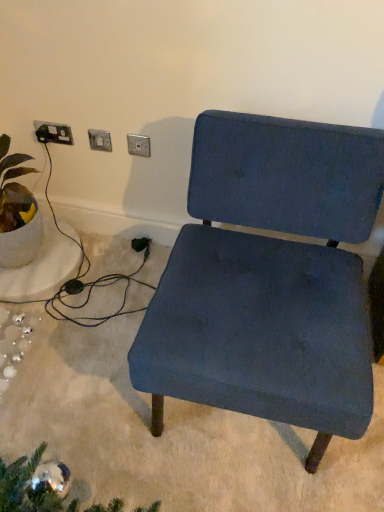
I want to click on matte silver switch at upper center, arranged as the second electric outlet when viewed from the right, so click(x=100, y=140).

The image size is (384, 512). Describe the element at coordinates (100, 140) in the screenshot. I see `matte silver switch at upper center, arranged as the second electric outlet when viewed from the right` at that location.

Where is `matte blue fabric chair at center`? The width and height of the screenshot is (384, 512). matte blue fabric chair at center is located at coordinates (269, 279).

This screenshot has width=384, height=512. Describe the element at coordinates (53, 133) in the screenshot. I see `black plastic socket at upper left, the first electric outlet positioned from the left` at that location.

How much space does black plastic socket at upper left, the first electric outlet positioned from the left, occupy vertically?

→ black plastic socket at upper left, the first electric outlet positioned from the left, is 3.38 inches in height.

The width and height of the screenshot is (384, 512). In order to click on metallic silver outlet at upper center, the 1th electric outlet from the right in this screenshot , I will do `click(138, 145)`.

Starting from the black plastic socket at upper left, the first electric outlet positioned from the left, which electric outlet is the 1st one to the right? Please provide its 2D coordinates.

[(100, 140)]

In the scene shown: Is matte silver switch at upper center, arranged as the second electric outlet when viewed from the right, thinner than black plastic socket at upper left, the first electric outlet positioned from the left?

Incorrect, the width of matte silver switch at upper center, arranged as the second electric outlet when viewed from the right, is not less than that of black plastic socket at upper left, the first electric outlet positioned from the left.

Is matte silver switch at upper center, arranged as the second electric outlet when viewed from the right, bigger than black plastic socket at upper left, placed as the 3th electric outlet when sorted from right to left?

No, matte silver switch at upper center, arranged as the second electric outlet when viewed from the right, is not bigger than black plastic socket at upper left, placed as the 3th electric outlet when sorted from right to left.

In the scene shown: Does matte blue fabric chair at center appear on the left side of black plastic socket at upper left, placed as the 3th electric outlet when sorted from right to left?

No, matte blue fabric chair at center is not to the left of black plastic socket at upper left, placed as the 3th electric outlet when sorted from right to left.

From a real-world perspective, between matte blue fabric chair at center and black plastic socket at upper left, placed as the 3th electric outlet when sorted from right to left, who is vertically higher?

In real-world perspective, black plastic socket at upper left, placed as the 3th electric outlet when sorted from right to left, is above.

From the image's perspective, is matte blue fabric chair at center located above black plastic socket at upper left, placed as the 3th electric outlet when sorted from right to left?

No.

Is matte blue fabric chair at center oriented away from black plastic socket at upper left, placed as the 3th electric outlet when sorted from right to left?

matte blue fabric chair at center is not turned away from black plastic socket at upper left, placed as the 3th electric outlet when sorted from right to left.

Is matte blue fabric chair at center bigger than matte silver switch at upper center, which appears as the 2th electric outlet when viewed from the left?

Yes, matte blue fabric chair at center is bigger than matte silver switch at upper center, which appears as the 2th electric outlet when viewed from the left.

Which is behind, point (336, 307) or point (104, 148)?

The point (104, 148) is more distant.

Based on the photo, would you consider matte blue fabric chair at center to be distant from matte silver switch at upper center, which appears as the 2th electric outlet when viewed from the left?

Actually, matte blue fabric chair at center and matte silver switch at upper center, which appears as the 2th electric outlet when viewed from the left, are a little close together.

In the scene shown: How different are the orientations of matte blue fabric chair at center and matte silver switch at upper center, which appears as the 2th electric outlet when viewed from the left, in degrees?

4.52 degrees.

From the image's perspective, relative to matte silver switch at upper center, which appears as the 2th electric outlet when viewed from the left, is metallic silver outlet at upper center, the 1th electric outlet from the right, above or below?

metallic silver outlet at upper center, the 1th electric outlet from the right, is situated lower than matte silver switch at upper center, which appears as the 2th electric outlet when viewed from the left, in the image.

In the scene shown: Is there a large distance between metallic silver outlet at upper center, the 1th electric outlet from the right, and matte silver switch at upper center, arranged as the second electric outlet when viewed from the right?

No, metallic silver outlet at upper center, the 1th electric outlet from the right, is not far away from matte silver switch at upper center, arranged as the second electric outlet when viewed from the right.

Consider the image. Between metallic silver outlet at upper center, the 1th electric outlet from the right, and matte silver switch at upper center, which appears as the 2th electric outlet when viewed from the left, which one appears on the left side from the viewer's perspective?

matte silver switch at upper center, which appears as the 2th electric outlet when viewed from the left.

How distant is metallic silver outlet at upper center, which is the third electric outlet in left-to-right order, from matte silver switch at upper center, arranged as the second electric outlet when viewed from the right?

11.06 centimeters.

In the scene shown: Measure the distance between metallic silver outlet at upper center, which is the third electric outlet in left-to-right order, and matte blue fabric chair at center.

27.67 inches.

From a real-world perspective, who is located lower, metallic silver outlet at upper center, the 1th electric outlet from the right, or matte blue fabric chair at center?

In real-world perspective, matte blue fabric chair at center is lower.

Is metallic silver outlet at upper center, which is the third electric outlet in left-to-right order, with matte blue fabric chair at center?

metallic silver outlet at upper center, which is the third electric outlet in left-to-right order, and matte blue fabric chair at center are not in contact.

Does metallic silver outlet at upper center, which is the third electric outlet in left-to-right order, appear on the left side of matte blue fabric chair at center?

Indeed, metallic silver outlet at upper center, which is the third electric outlet in left-to-right order, is positioned on the left side of matte blue fabric chair at center.

Considering the positions of points (148, 153) and (3, 156), is point (148, 153) closer to camera compared to point (3, 156)?

No, it is behind (3, 156).

Based on the photo, is metallic silver outlet at upper center, the 1th electric outlet from the right, positioned with its back to green leafy plant in white pot at left?

metallic silver outlet at upper center, the 1th electric outlet from the right, does not have its back to green leafy plant in white pot at left.

This screenshot has width=384, height=512. Find the location of `houseplant below the metallic silver outlet at upper center, the 1th electric outlet from the right (from the image's perspective)`. houseplant below the metallic silver outlet at upper center, the 1th electric outlet from the right (from the image's perspective) is located at coordinates (16, 211).

Would you say matte silver switch at upper center, arranged as the second electric outlet when viewed from the right, is to the left or to the right of metallic silver outlet at upper center, the 1th electric outlet from the right, in the picture?

Clearly, matte silver switch at upper center, arranged as the second electric outlet when viewed from the right, is on the left of metallic silver outlet at upper center, the 1th electric outlet from the right, in the image.

Relative to metallic silver outlet at upper center, which is the third electric outlet in left-to-right order, is matte silver switch at upper center, arranged as the second electric outlet when viewed from the right, in front or behind?

matte silver switch at upper center, arranged as the second electric outlet when viewed from the right, is behind metallic silver outlet at upper center, which is the third electric outlet in left-to-right order.

Is matte silver switch at upper center, arranged as the second electric outlet when viewed from the right, facing towards metallic silver outlet at upper center, the 1th electric outlet from the right?

No, matte silver switch at upper center, arranged as the second electric outlet when viewed from the right, is not turned towards metallic silver outlet at upper center, the 1th electric outlet from the right.

In the image, there is a metallic silver outlet at upper center, which is the third electric outlet in left-to-right order. Where is `electric outlet below it (from a real-world perspective)`? The width and height of the screenshot is (384, 512). electric outlet below it (from a real-world perspective) is located at coordinates (100, 140).

In order to click on electric outlet on the left of matte silver switch at upper center, arranged as the second electric outlet when viewed from the right in this screenshot , I will do `click(53, 133)`.

Locate an element on the screen. the 3rd electric outlet above the matte blue fabric chair at center (from the image's perspective) is located at coordinates (53, 133).

From the image, which object appears to be farther from black plastic socket at upper left, placed as the 3th electric outlet when sorted from right to left, matte blue fabric chair at center or matte silver switch at upper center, arranged as the second electric outlet when viewed from the right?

Among the two, matte blue fabric chair at center is located further to black plastic socket at upper left, placed as the 3th electric outlet when sorted from right to left.

Estimate the real-world distances between objects in this image. Which object is further from green leafy plant in white pot at left, matte silver switch at upper center, arranged as the second electric outlet when viewed from the right, or metallic silver outlet at upper center, which is the third electric outlet in left-to-right order?

metallic silver outlet at upper center, which is the third electric outlet in left-to-right order, is further to green leafy plant in white pot at left.

Considering their positions, is green leafy plant in white pot at left positioned further to matte blue fabric chair at center than matte silver switch at upper center, which appears as the 2th electric outlet when viewed from the left?

green leafy plant in white pot at left.

Looking at the image, which one is located further to green leafy plant in white pot at left, metallic silver outlet at upper center, which is the third electric outlet in left-to-right order, or black plastic socket at upper left, the first electric outlet positioned from the left?

The object further to green leafy plant in white pot at left is metallic silver outlet at upper center, which is the third electric outlet in left-to-right order.

When comparing their distances from metallic silver outlet at upper center, which is the third electric outlet in left-to-right order, does green leafy plant in white pot at left or matte blue fabric chair at center seem closer?

Among the two, green leafy plant in white pot at left is located nearer to metallic silver outlet at upper center, which is the third electric outlet in left-to-right order.

From the image, which object appears to be farther from matte blue fabric chair at center, black plastic socket at upper left, the first electric outlet positioned from the left, or metallic silver outlet at upper center, which is the third electric outlet in left-to-right order?

black plastic socket at upper left, the first electric outlet positioned from the left.

Looking at the image, which one is located closer to black plastic socket at upper left, placed as the 3th electric outlet when sorted from right to left, metallic silver outlet at upper center, which is the third electric outlet in left-to-right order, or green leafy plant in white pot at left?

Based on the image, metallic silver outlet at upper center, which is the third electric outlet in left-to-right order, appears to be nearer to black plastic socket at upper left, placed as the 3th electric outlet when sorted from right to left.

Based on their spatial positions, is matte silver switch at upper center, which appears as the 2th electric outlet when viewed from the left, or metallic silver outlet at upper center, the 1th electric outlet from the right, further from black plastic socket at upper left, placed as the 3th electric outlet when sorted from right to left?

metallic silver outlet at upper center, the 1th electric outlet from the right.

The height and width of the screenshot is (512, 384). I want to click on electric outlet located between black plastic socket at upper left, the first electric outlet positioned from the left, and metallic silver outlet at upper center, which is the third electric outlet in left-to-right order, in the left-right direction, so click(100, 140).

What are the coordinates of `electric outlet between matte blue fabric chair at center and matte silver switch at upper center, which appears as the 2th electric outlet when viewed from the left, along the z-axis` in the screenshot? It's located at (138, 145).